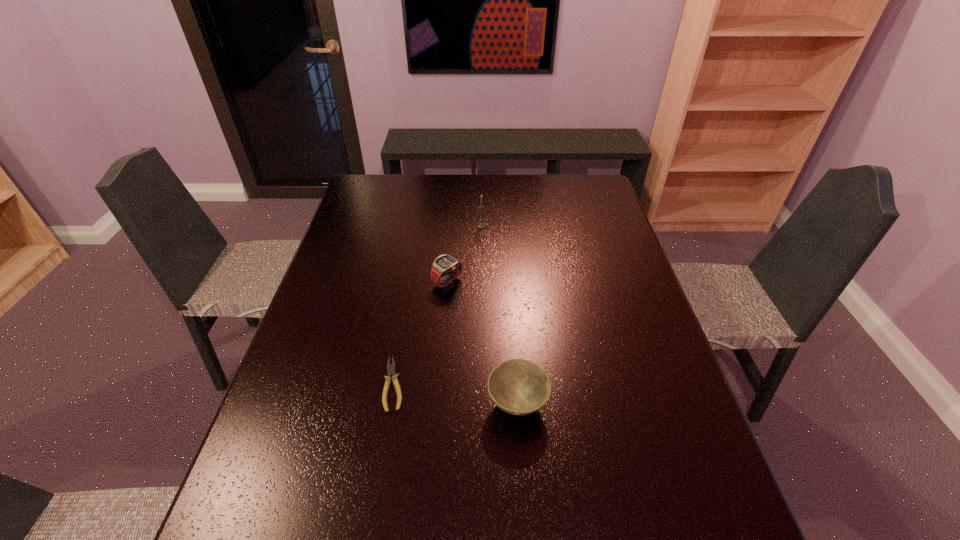
Where is `vacant space that satisfies the following two spatial constraints: 1. on the back side of the watch; 2. on the right side of the leftmost object`? This screenshot has width=960, height=540. vacant space that satisfies the following two spatial constraints: 1. on the back side of the watch; 2. on the right side of the leftmost object is located at coordinates (411, 281).

This screenshot has width=960, height=540. What are the coordinates of `vacant space that satisfies the following two spatial constraints: 1. on the front side of the bowl; 2. on the left side of the leftmost object` in the screenshot? It's located at (391, 403).

Locate an element on the screen. free space in the image that satisfies the following two spatial constraints: 1. on the back side of the candle; 2. on the left side of the third object from right to left is located at coordinates (452, 226).